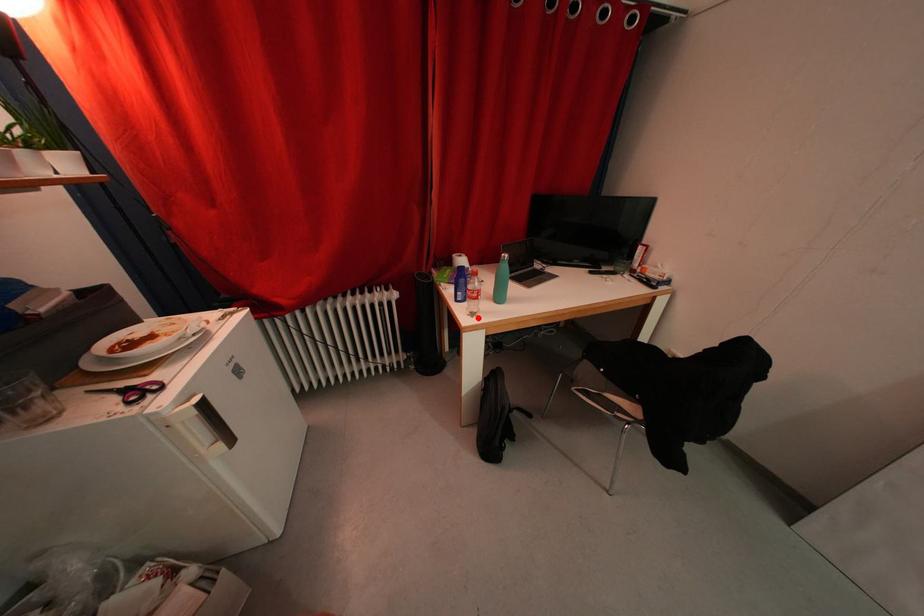
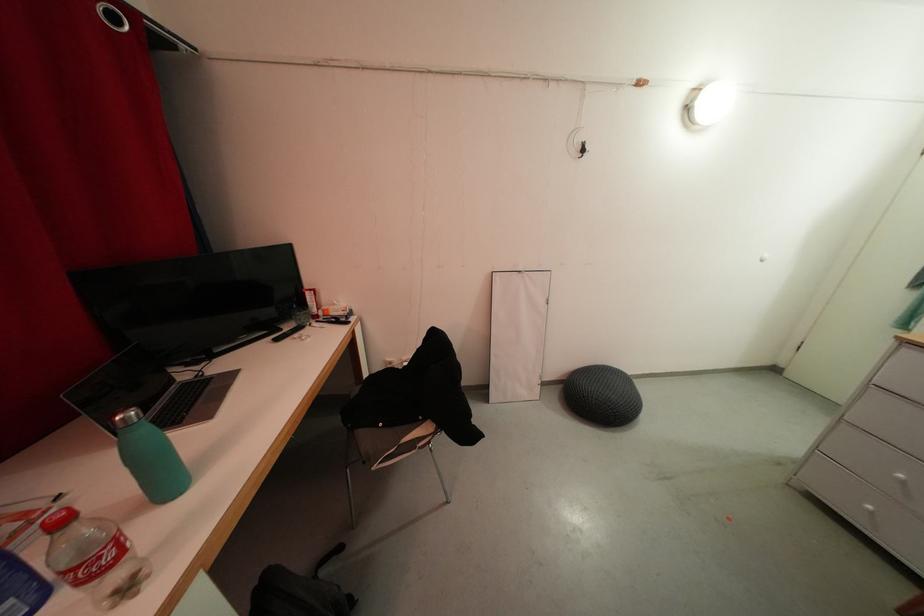
The point at the highlighted location is marked in the first image. Where is the corresponding point in the second image?

(134, 593)